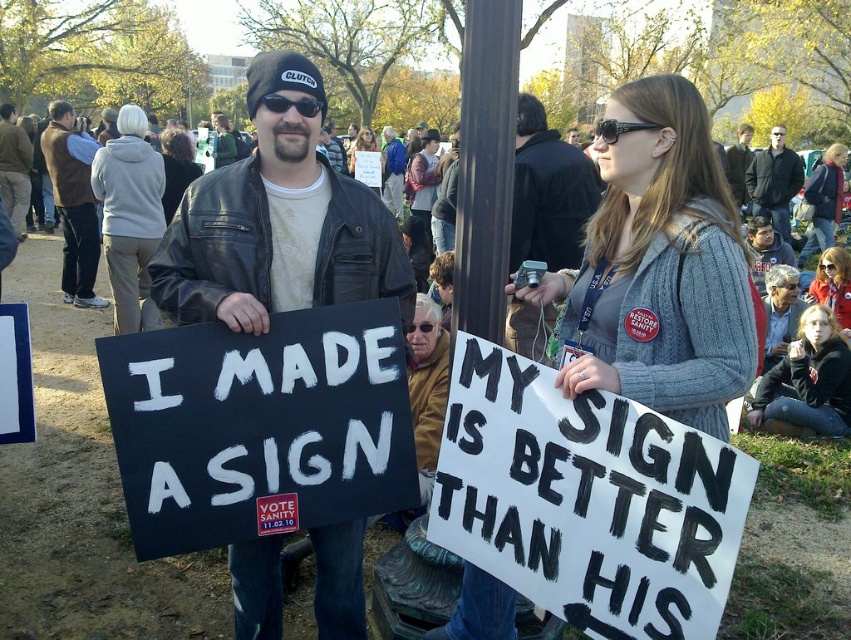
Who is taller, brown leather jacket at left or dark brown hair at center?

brown leather jacket at left

Is brown leather jacket at left shorter than dark brown hair at center?

No, brown leather jacket at left is not shorter than dark brown hair at center.

Is point (30, 154) positioned behind point (180, 141)?

Yes, point (30, 154) is behind point (180, 141).

I want to click on brown leather jacket at left, so click(14, 168).

Is brown suede vest at left smaller than denim jacket at upper center?

Actually, brown suede vest at left might be larger than denim jacket at upper center.

Is brown suede vest at left taller than denim jacket at upper center?

Correct, brown suede vest at left is much taller as denim jacket at upper center.

Does point (73, 244) lie behind point (812, 218)?

That is False.

The image size is (851, 640). In order to click on brown suede vest at left in this screenshot , I will do `click(73, 204)`.

Does dark gray jacket at upper center appear on the left side of dark brown hair at center?

No, dark gray jacket at upper center is not to the left of dark brown hair at center.

How much distance is there between dark gray jacket at upper center and dark brown hair at center?

7.04 meters

Is point (797, 189) farther from viewer compared to point (175, 129)?

That is True.

Where is `dark gray jacket at upper center`? This screenshot has height=640, width=851. dark gray jacket at upper center is located at coordinates (774, 180).